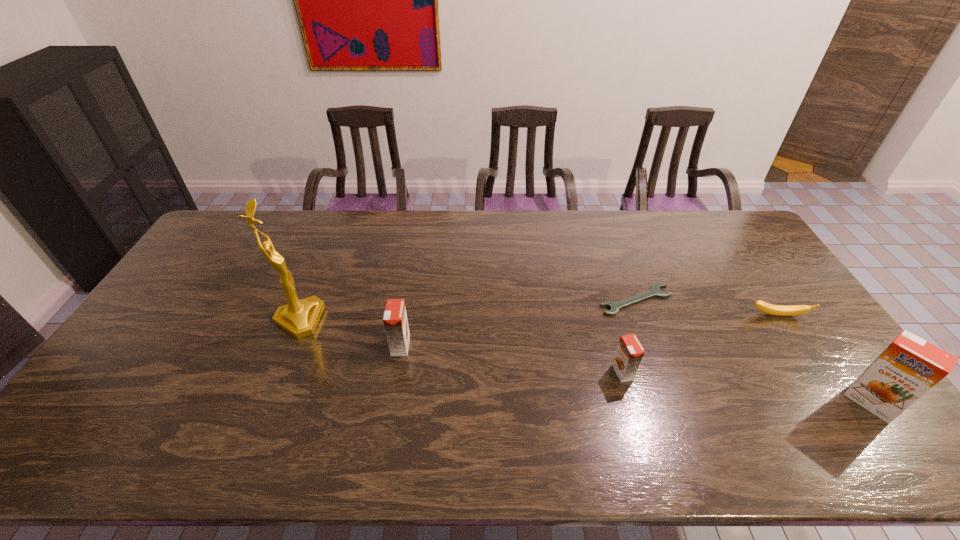
Locate an element on the screen. This screenshot has width=960, height=540. vacant region at the far edge of the desktop is located at coordinates (483, 228).

Identify the location of vacant space at the near edge of the desktop. This screenshot has width=960, height=540. (225, 390).

This screenshot has width=960, height=540. In the image, there is a desktop. In order to click on vacant space at the left edge in this screenshot , I will do `click(224, 281)`.

Identify the location of free location at the right edge of the desktop. Image resolution: width=960 pixels, height=540 pixels. (824, 353).

Find the location of a particular element. The image size is (960, 540). vacant area at the far right corner is located at coordinates (748, 231).

The image size is (960, 540). I want to click on free space between the second orange juice from right to left and the banana, so click(x=700, y=344).

Image resolution: width=960 pixels, height=540 pixels. I want to click on vacant space that's between the fifth shortest object and the shortest object, so click(754, 351).

Find the location of `free area in between the award and the third shortest object`. free area in between the award and the third shortest object is located at coordinates (461, 346).

Locate an element on the screen. The height and width of the screenshot is (540, 960). free spot between the wrench and the banana is located at coordinates (707, 308).

Identify the location of free space between the wrench and the second tallest object. The image size is (960, 540). (754, 351).